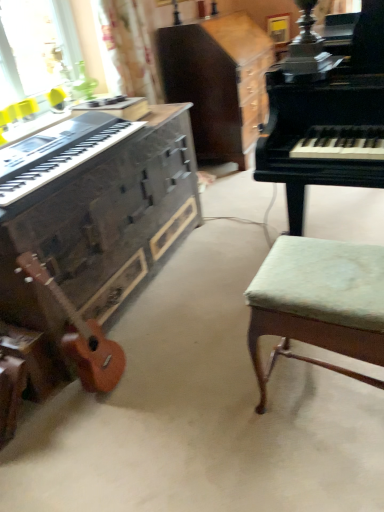
This screenshot has width=384, height=512. Describe the element at coordinates (95, 231) in the screenshot. I see `wooden piano at left, which ranks as the 2th piano in right-to-left order` at that location.

What do you see at coordinates (319, 303) in the screenshot? Image resolution: width=384 pixels, height=512 pixels. I see `green fabric stool at right` at bounding box center [319, 303].

What is the approximate width of green fabric stool at right?

14.27 inches.

Image resolution: width=384 pixels, height=512 pixels. What are the coordinates of `wooden acoustic guitar at lower left` in the screenshot? It's located at (81, 336).

The width and height of the screenshot is (384, 512). What do you see at coordinates (81, 336) in the screenshot?
I see `wooden acoustic guitar at lower left` at bounding box center [81, 336].

The width and height of the screenshot is (384, 512). I want to click on wooden cabinet at center, so click(218, 82).

Is wooden cabinet at center facing away from wooden acoustic guitar at lower left?

wooden cabinet at center does not have its back to wooden acoustic guitar at lower left.

Does wooden cabinet at center come in front of wooden acoustic guitar at lower left?

That is False.

Based on the photo, considering the sizes of objects wooden cabinet at center and wooden acoustic guitar at lower left in the image provided, who is smaller, wooden cabinet at center or wooden acoustic guitar at lower left?

wooden acoustic guitar at lower left.

From a real-world perspective, which is physically above, wooden cabinet at center or wooden acoustic guitar at lower left?

wooden cabinet at center.

Which of these two, wooden piano at left, which ranks as the 2th piano in right-to-left order, or black polished piano at upper right, the first piano in the right-to-left sequence, is wider?

black polished piano at upper right, the first piano in the right-to-left sequence, is wider.

Is black polished piano at upper right, arranged as the 2th piano when viewed from the left, inside wooden piano at left, arranged as the 1th piano when viewed from the left?

Actually, black polished piano at upper right, arranged as the 2th piano when viewed from the left, is outside wooden piano at left, arranged as the 1th piano when viewed from the left.

Is wooden piano at left, which ranks as the 2th piano in right-to-left order, oriented away from black polished piano at upper right, the first piano in the right-to-left sequence?

No, wooden piano at left, which ranks as the 2th piano in right-to-left order,'s orientation is not away from black polished piano at upper right, the first piano in the right-to-left sequence.

From the image's perspective, would you say green fabric stool at right is shown under black polished piano at upper right, the first piano in the right-to-left sequence?

Indeed, from the image's perspective, green fabric stool at right is shown beneath black polished piano at upper right, the first piano in the right-to-left sequence.

Is green fabric stool at right turned away from black polished piano at upper right, arranged as the 2th piano when viewed from the left?

No, green fabric stool at right is not facing away from black polished piano at upper right, arranged as the 2th piano when viewed from the left.

From a real-world perspective, does green fabric stool at right stand above black polished piano at upper right, the first piano in the right-to-left sequence?

No, from a real-world perspective, green fabric stool at right is not on top of black polished piano at upper right, the first piano in the right-to-left sequence.

Is green fabric stool at right completely or partially outside of black polished piano at upper right, arranged as the 2th piano when viewed from the left?

Yes, green fabric stool at right is not within black polished piano at upper right, arranged as the 2th piano when viewed from the left.

From a real-world perspective, which is physically above, matte black keyboard at left or wooden cabinet at center?

matte black keyboard at left.

Is matte black keyboard at left not inside wooden cabinet at center?

Yes, matte black keyboard at left is not within wooden cabinet at center.

What's the angular difference between matte black keyboard at left and wooden cabinet at center's facing directions?

The angular difference between matte black keyboard at left and wooden cabinet at center is 1.47 degrees.

There is a wooden cabinet at center. Where is `musical keyboard above it (from a real-world perspective)`? musical keyboard above it (from a real-world perspective) is located at coordinates (62, 153).

Is wooden acoustic guitar at lower left at the back of green fabric stool at right?

No, green fabric stool at right is not facing away from wooden acoustic guitar at lower left.

Does green fabric stool at right have a smaller size compared to wooden acoustic guitar at lower left?

Incorrect, green fabric stool at right is not smaller in size than wooden acoustic guitar at lower left.

Can you confirm if green fabric stool at right is taller than wooden acoustic guitar at lower left?

No.

Is green fabric stool at right far away from wooden acoustic guitar at lower left?

That's not correct — green fabric stool at right is a little close to wooden acoustic guitar at lower left.

Is point (341, 166) closer or farther from the camera than point (104, 140)?

Clearly, point (341, 166) is closer to the camera than point (104, 140).

In the scene shown: Can we say black polished piano at upper right, arranged as the 2th piano when viewed from the left, lies outside matte black keyboard at left?

black polished piano at upper right, arranged as the 2th piano when viewed from the left, lies outside matte black keyboard at left's area.

You are a GUI agent. You are given a task and a screenshot of the screen. Output one action in this format:
    pyautogui.click(x=<x>, y=<y>)
    Task: Click on the piano in front of the matte black keyboard at left
    
    Given the screenshot: What is the action you would take?
    pyautogui.click(x=328, y=118)

Considering the positions of objects black polished piano at upper right, the first piano in the right-to-left sequence, and matte black keyboard at left in the image provided, who is in front, black polished piano at upper right, the first piano in the right-to-left sequence, or matte black keyboard at left?

black polished piano at upper right, the first piano in the right-to-left sequence.

Is wooden acoustic guitar at lower left next to black polished piano at upper right, the first piano in the right-to-left sequence?

There is a gap between wooden acoustic guitar at lower left and black polished piano at upper right, the first piano in the right-to-left sequence.

Which object is positioned more to the right, wooden acoustic guitar at lower left or black polished piano at upper right, arranged as the 2th piano when viewed from the left?

Positioned to the right is black polished piano at upper right, arranged as the 2th piano when viewed from the left.

Is wooden acoustic guitar at lower left taller than black polished piano at upper right, the first piano in the right-to-left sequence?

In fact, wooden acoustic guitar at lower left may be shorter than black polished piano at upper right, the first piano in the right-to-left sequence.

The height and width of the screenshot is (512, 384). Find the location of `guitar that appears on the left of wooden cabinet at center`. guitar that appears on the left of wooden cabinet at center is located at coordinates pyautogui.click(x=81, y=336).

Locate an element on the screen. The image size is (384, 512). piano above the wooden piano at left, which ranks as the 2th piano in right-to-left order (from the image's perspective) is located at coordinates pos(328,118).

Based on their spatial positions, is wooden cabinet at center or green fabric stool at right closer to matte black keyboard at left?

green fabric stool at right lies closer to matte black keyboard at left than the other object.

Which object lies further to the anchor point wooden piano at left, which ranks as the 2th piano in right-to-left order, matte black keyboard at left or black polished piano at upper right, arranged as the 2th piano when viewed from the left?

Based on the image, black polished piano at upper right, arranged as the 2th piano when viewed from the left, appears to be further to wooden piano at left, which ranks as the 2th piano in right-to-left order.

Considering their positions, is green fabric stool at right positioned closer to black polished piano at upper right, arranged as the 2th piano when viewed from the left, than matte black keyboard at left?

green fabric stool at right.

Estimate the real-world distances between objects in this image. Which object is further from black polished piano at upper right, the first piano in the right-to-left sequence, wooden cabinet at center or wooden piano at left, arranged as the 1th piano when viewed from the left?

wooden cabinet at center.

Estimate the real-world distances between objects in this image. Which object is closer to wooden piano at left, which ranks as the 2th piano in right-to-left order, wooden acoustic guitar at lower left or wooden cabinet at center?

wooden acoustic guitar at lower left is closer to wooden piano at left, which ranks as the 2th piano in right-to-left order.

From the image, which object appears to be nearer to matte black keyboard at left, wooden cabinet at center or wooden acoustic guitar at lower left?

The object closer to matte black keyboard at left is wooden acoustic guitar at lower left.

Consider the image. Considering their positions, is wooden piano at left, arranged as the 1th piano when viewed from the left, positioned closer to matte black keyboard at left than black polished piano at upper right, the first piano in the right-to-left sequence?

wooden piano at left, arranged as the 1th piano when viewed from the left, is positioned closer to the anchor matte black keyboard at left.

From the image, which object appears to be farther from wooden piano at left, arranged as the 1th piano when viewed from the left, wooden cabinet at center or matte black keyboard at left?

wooden cabinet at center.

Find the location of `guitar between wooden cabinet at center and green fabric stool at right in the vertical direction`. guitar between wooden cabinet at center and green fabric stool at right in the vertical direction is located at coordinates (81, 336).

Where is `musical keyboard between green fabric stool at right and wooden cabinet at center along the z-axis`? The image size is (384, 512). musical keyboard between green fabric stool at right and wooden cabinet at center along the z-axis is located at coordinates (62, 153).

Where is `stool between matte black keyboard at left and black polished piano at upper right, the first piano in the right-to-left sequence`? The width and height of the screenshot is (384, 512). stool between matte black keyboard at left and black polished piano at upper right, the first piano in the right-to-left sequence is located at coordinates (319, 303).

Locate an element on the screen. stool between wooden acoustic guitar at lower left and black polished piano at upper right, the first piano in the right-to-left sequence, from left to right is located at coordinates (319, 303).